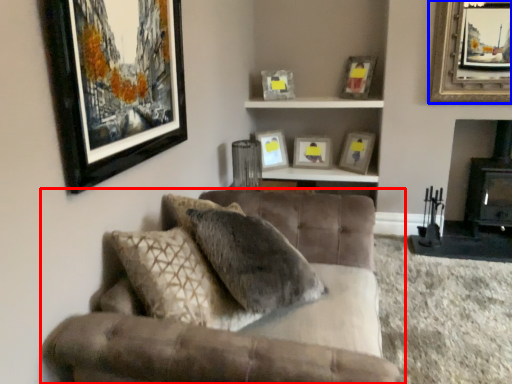
Question: Which object is further to the camera taking this photo, studio couch (highlighted by a red box) or picture frame (highlighted by a blue box)?

Choices:
 (A) studio couch
 (B) picture frame

Answer: (B)